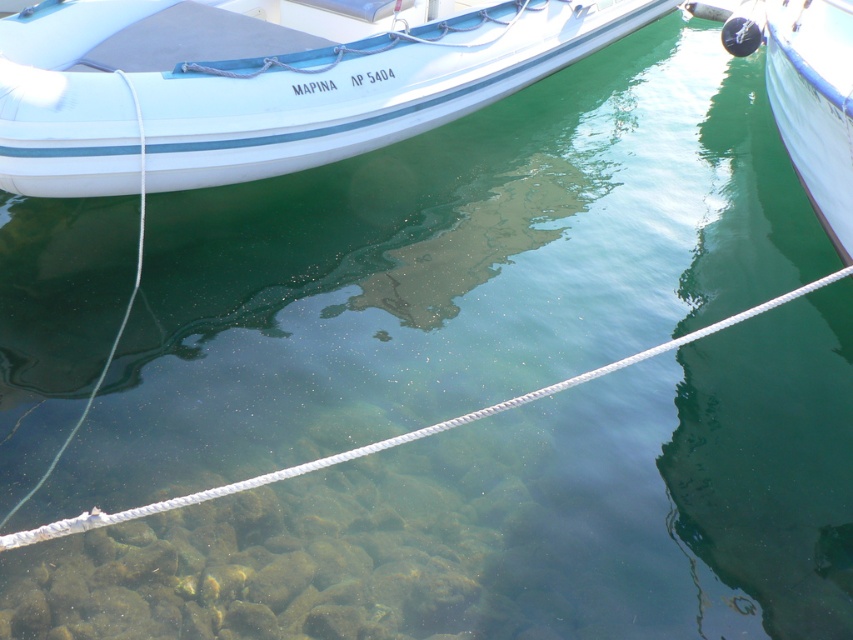
Where is `white matte boat at upper left`? white matte boat at upper left is located at coordinates (262, 81).

Which is in front, point (157, 32) or point (741, 316)?

Point (741, 316)

I want to click on white matte boat at upper left, so click(x=262, y=81).